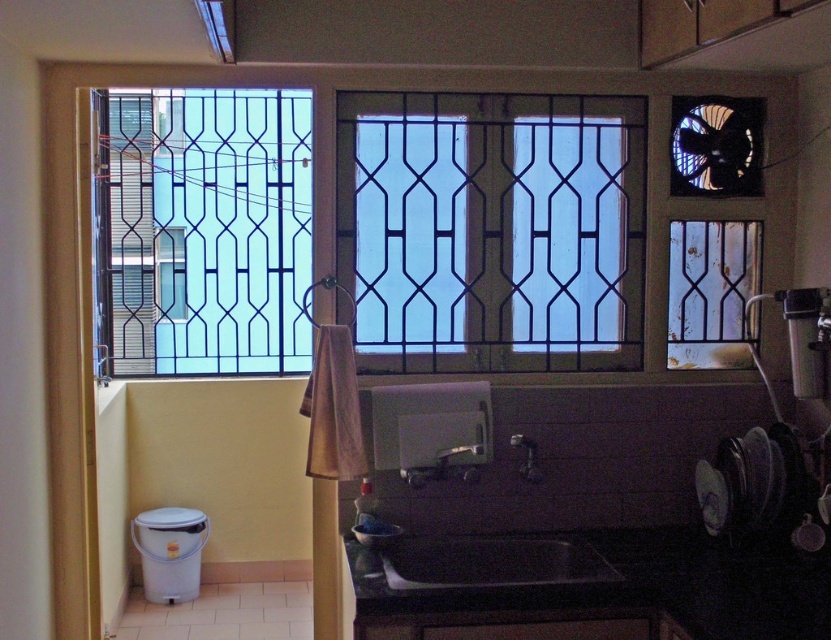
You are a painter who needs to place a ladder in the kitchen to clean the blue glass window at left and the metallic grid at upper right. The ladder you have is 2.5 meters long. Can you safely reach both objects with the ladder?

The distance between the blue glass window at left and the metallic grid at upper right is 2.70 meters. Since the ladder is only 2.5 meters long, it is too short to safely reach both objects.

You are a kitchen designer planning to place a small 4 inch wide spice rack between the black matte counter top at lower center and the black matte sink at lower center. Will there be enough space?

The distance between the black matte counter top at lower center and the black matte sink at lower center is 4.10 inches. Since the spice rack is 4 inches wide, there will be enough space to place it between them with a small gap remaining.

You are trying to place a rectangular cutting board on the black matte counter top at lower center next to the black matte sink at lower center. Based on their widths, will the cutting board fit entirely on the counter top without overhanging the sink?

The black matte counter top at lower center is wider than the black matte sink at lower center. Since the counter top is wider, the cutting board should fit entirely on the counter top without overhanging the sink.